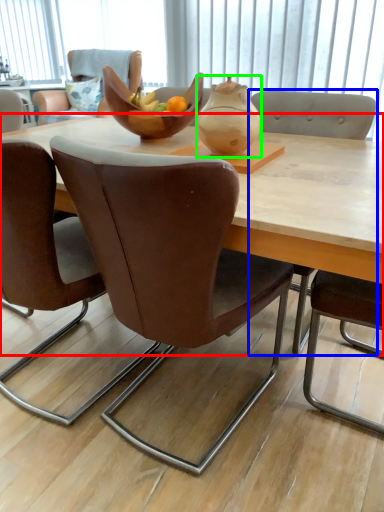
Question: Which is farther away from coffee table (highlighted by a red box)? chair (highlighted by a blue box) or tea pot (highlighted by a green box)?

Choices:
 (A) chair
 (B) tea pot

Answer: (A)